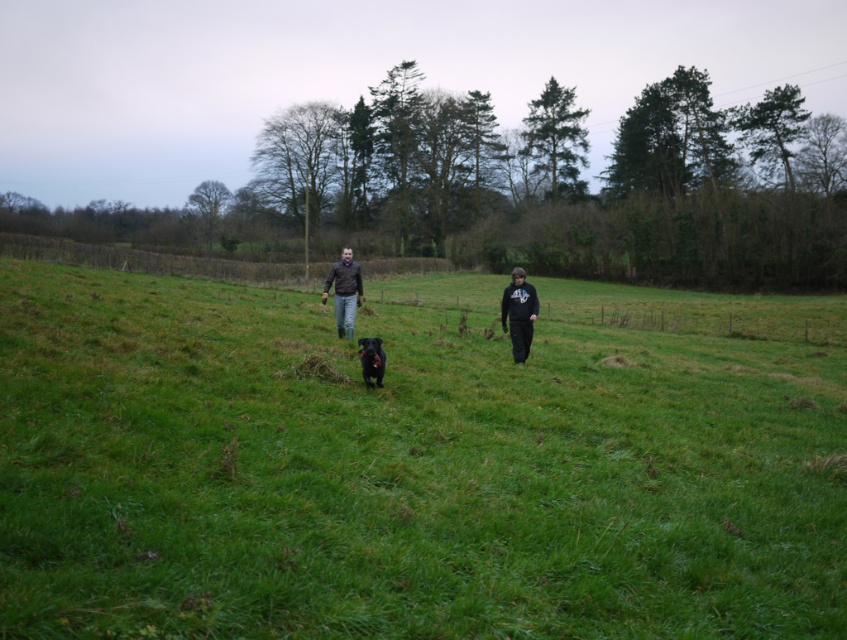
You are standing in the field looking towards the fence. Which object, the green grass at center or the black matte sweatshirt at center, is closer to your right side?

The black matte sweatshirt at center is closer to your right side because the green grass at center is to the left of it.

You are a photographer standing at the edge of the field. You want to take a photo of both the black matte sweatshirt at center and the black furry dog at center. Since the dog is behind the sweatshirt, will the dog be fully visible in the photo?

The black furry dog at center is behind the black matte sweatshirt at center, so part of the dog may be obscured by the sweatshirt in the photo.

You are standing in the middle of the field and see two points marked in the image. Which point is closer to you, point (507, 301) or point (358, 342)?

Point (358, 342) is closer to you because it is less further to the camera than point (507, 301).